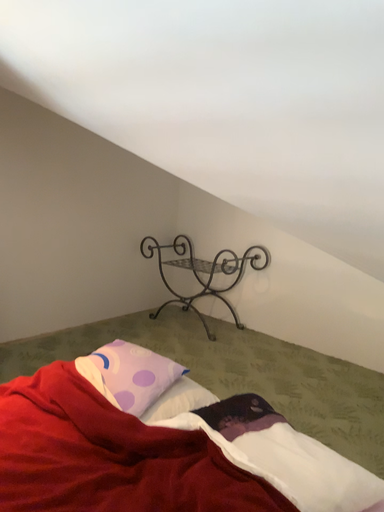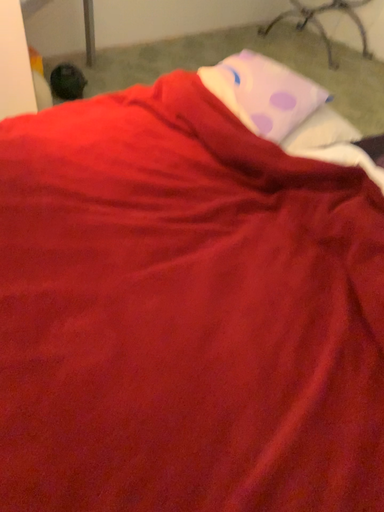
Question: Which way did the camera rotate in the video?

Choices:
 (A) rotated downward
 (B) rotated upward

Answer: (A)